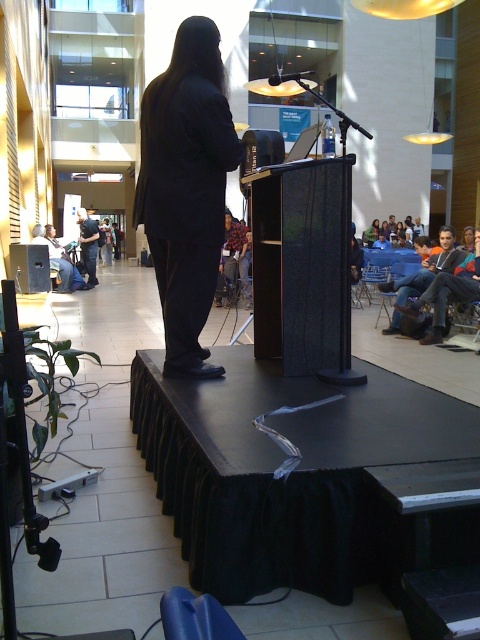
Question: Which of the following is the closest to the observer?

Choices:
 (A) (237, 259)
 (B) (148, 124)
 (C) (442, 266)

Answer: (B)

Question: Which point is closer to the camera?

Choices:
 (A) (226, 220)
 (B) (208, 307)

Answer: (B)

Question: Does black smooth suit at center have a lesser width compared to denim jacket at center?

Choices:
 (A) yes
 (B) no

Answer: (A)

Question: Is flannel shirt at center behind denim jacket at center?

Choices:
 (A) no
 (B) yes

Answer: (A)

Question: Considering the relative positions of blue jeans at center and denim jacket at center in the image provided, where is blue jeans at center located with respect to denim jacket at center?

Choices:
 (A) below
 (B) above

Answer: (A)

Question: Which point appears closest to the camera in this image?

Choices:
 (A) click(x=427, y=273)
 (B) click(x=233, y=257)
 (C) click(x=299, y=83)
 (D) click(x=93, y=266)

Answer: (C)